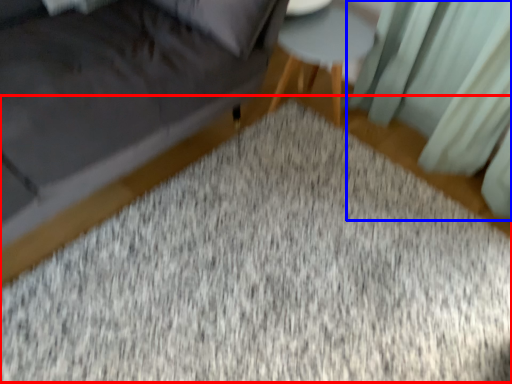
Question: Which object is further to the camera taking this photo, mat (highlighted by a red box) or curtain (highlighted by a blue box)?

Choices:
 (A) mat
 (B) curtain

Answer: (B)